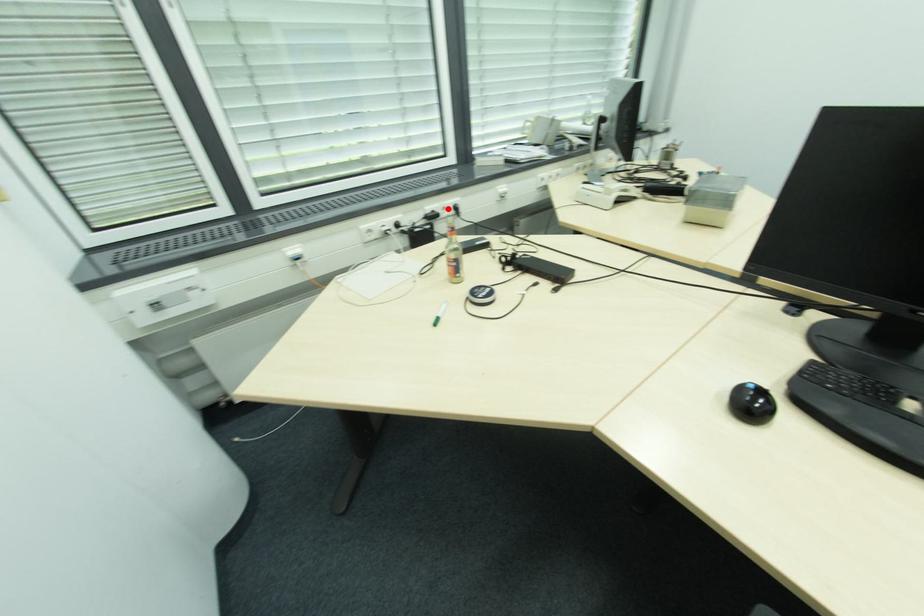
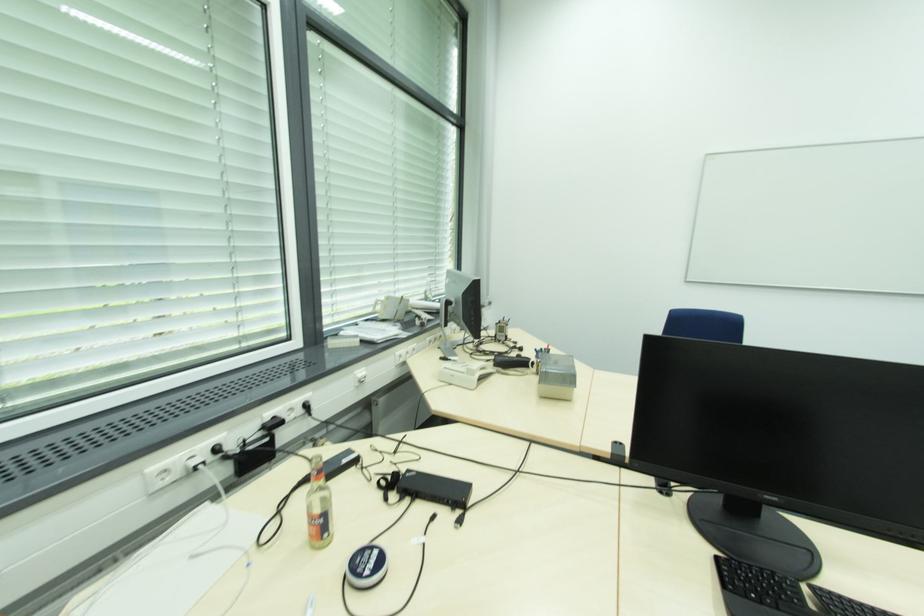
Locate, in the second image, the point that corresponds to the highlighted location in the first image.

(294, 410)